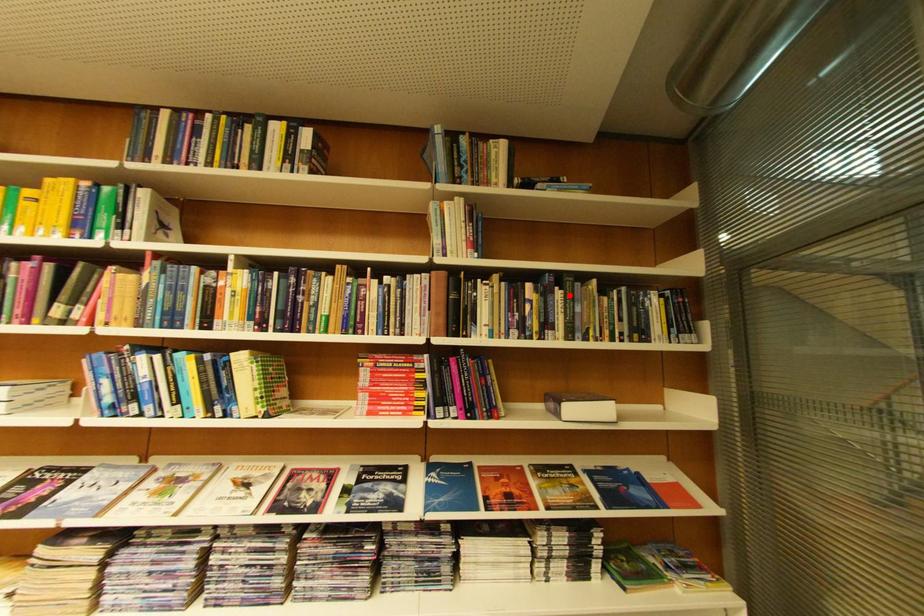
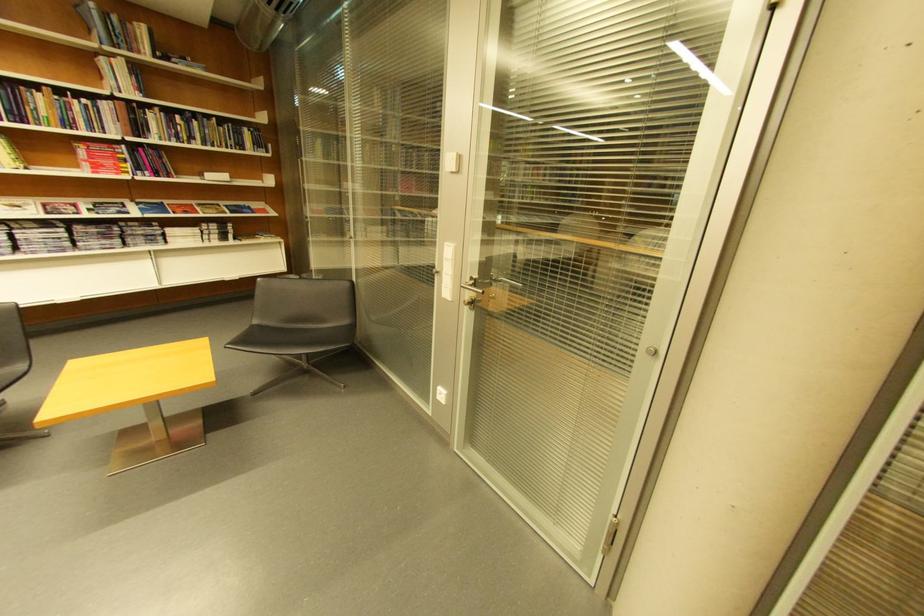
Locate, in the second image, the point that corresponds to the highlighted location in the first image.

(205, 124)